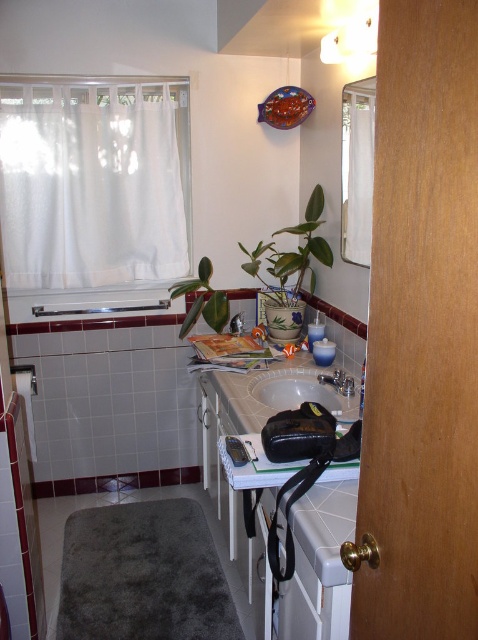
You are standing in the bathroom and want to reach the point at coordinates (304, 240). The room is 3 meters long from the entrance to the farthest wall. Can you walk to that point without needing to go beyond the room?

The point at coordinates (304, 240) is 2.82 meters away from the camera, which is within the 3 meters length of the room. Therefore, you can walk to that point without needing to go beyond the room.

Based on the photo, you are a delivery person who needs to place a package that is 3.5 feet long on the floor in this bathroom. The package must be placed in a straight line from where you are standing. Based on the white glossy vanity at center, can you fit the package in that direction?

The distance between the white glossy vanity at center and the camera is 3.79 feet. Since the package is 3.5 feet long, it can fit in that direction as the available space is slightly longer than the package.